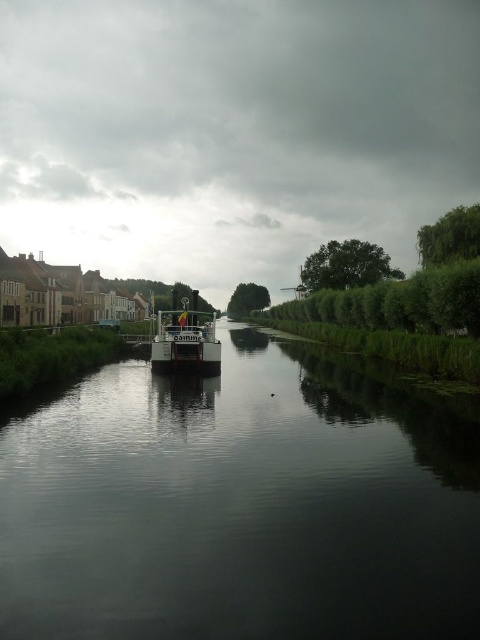
Who is taller, dark reflective water at center or white glossy boat at center?

Standing taller between the two is white glossy boat at center.

Is point (36, 564) closer to camera compared to point (212, 314)?

That is True.

Find the location of a particular element. This screenshot has width=480, height=640. dark reflective water at center is located at coordinates (242, 502).

Does dark reflective water at center come behind cloudy sky at upper center?

No, it is not.

Is dark reflective water at center shorter than cloudy sky at upper center?

Yes, dark reflective water at center is shorter than cloudy sky at upper center.

Identify the location of dark reflective water at center. The height and width of the screenshot is (640, 480). (242, 502).

Does cloudy sky at upper center appear under white glossy boat at center?

No, cloudy sky at upper center is not below white glossy boat at center.

Which is behind, point (347, 216) or point (188, 308)?

Positioned behind is point (347, 216).

This screenshot has width=480, height=640. I want to click on cloudy sky at upper center, so click(x=232, y=132).